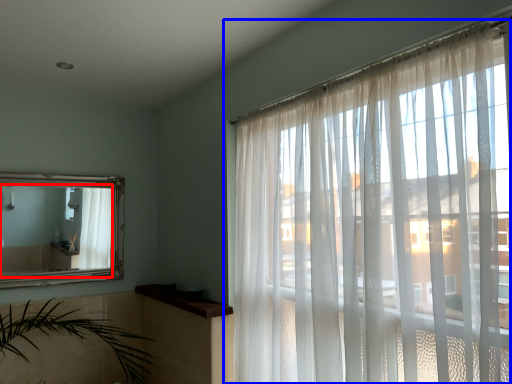
Question: Which of the following is the farthest to the observer, mirror (highlighted by a red box) or window (highlighted by a blue box)?

Choices:
 (A) mirror
 (B) window

Answer: (A)